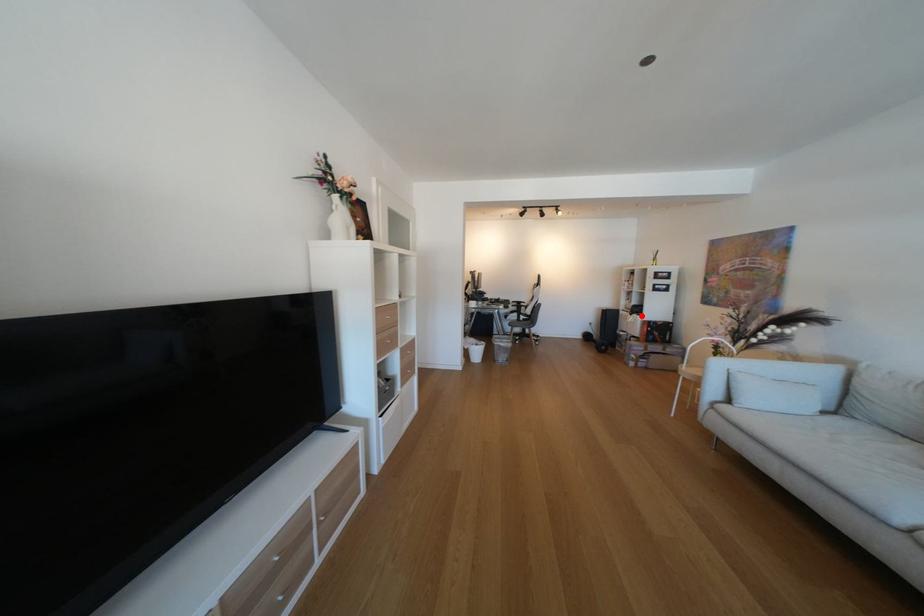
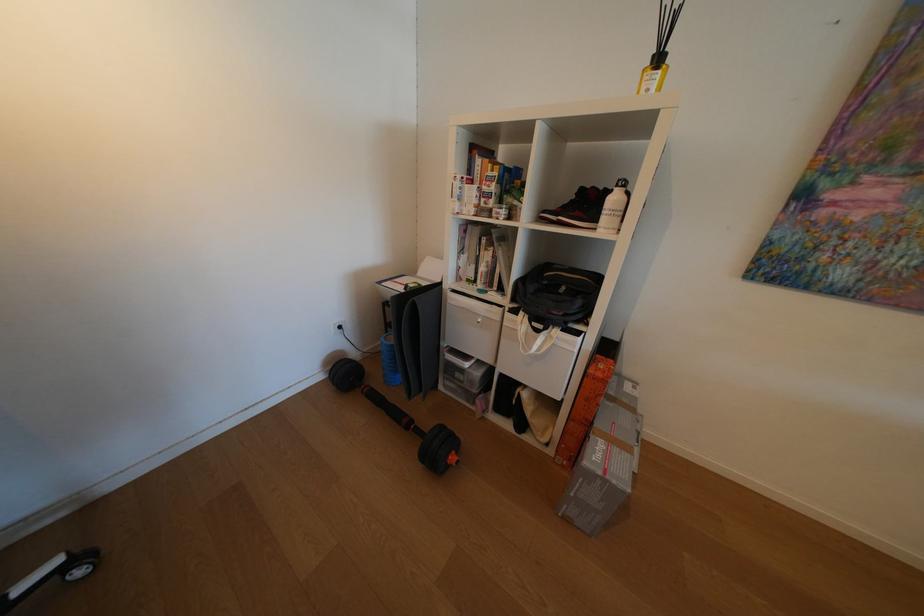
The point at the highlighted location is marked in the first image. Where is the corresponding point in the second image?

(548, 331)